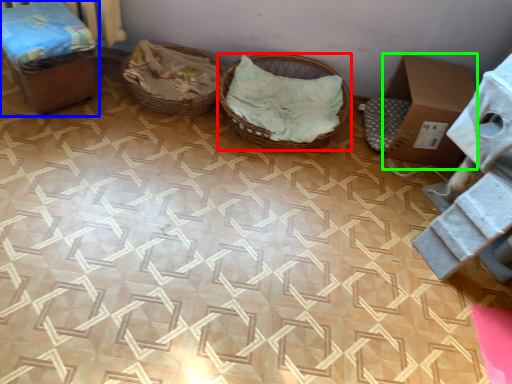
Question: Considering the real-world distances, which object is closest to basket (highlighted by a red box)? furniture (highlighted by a blue box) or cardboard box (highlighted by a green box).

Choices:
 (A) furniture
 (B) cardboard box

Answer: (B)